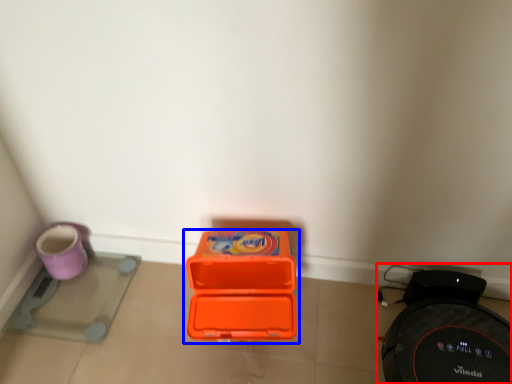
Question: Which of the following is the farthest to the observer, appliance (highlighted by a red box) or box (highlighted by a blue box)?

Choices:
 (A) appliance
 (B) box

Answer: (B)